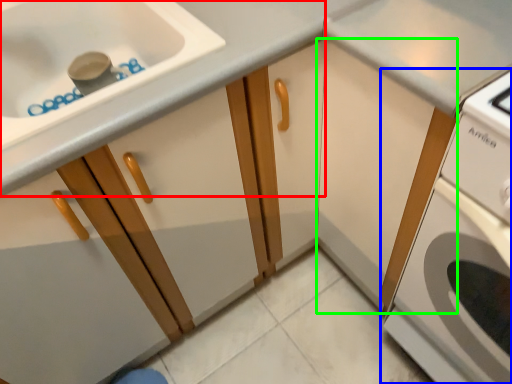
Question: Based on their relative distances, which object is nearer to cabinetry (highlighted by a red box)? Choose from home appliance (highlighted by a blue box) and cabinetry (highlighted by a green box).

Choices:
 (A) home appliance
 (B) cabinetry

Answer: (B)